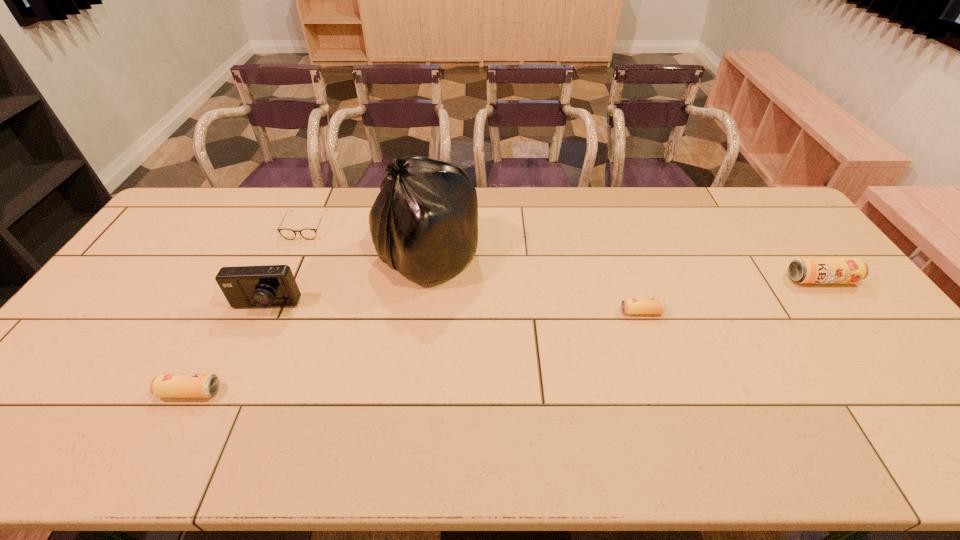
Identify the location of blank area located on the right of the second shortest beer can. Image resolution: width=960 pixels, height=540 pixels. (382, 392).

Where is `free space located 0.080m on the left of the fifth object from left to right`? The height and width of the screenshot is (540, 960). free space located 0.080m on the left of the fifth object from left to right is located at coordinates (x=592, y=312).

The height and width of the screenshot is (540, 960). Find the location of `blank space located on the left of the tallest beer can`. blank space located on the left of the tallest beer can is located at coordinates (712, 280).

Locate an element on the screen. free space located on the front-facing side of the second tallest object is located at coordinates (220, 407).

Locate an element on the screen. Image resolution: width=960 pixels, height=540 pixels. free space located 0.240m through the lenses of the spectacles is located at coordinates (276, 294).

At what (x,y) coordinates should I click in order to perform the action: click on vacant position located on the right of the tallest object. Please return your answer as a coordinate pair (x, y). Looking at the image, I should click on (569, 255).

You are a GUI agent. You are given a task and a screenshot of the screen. Output one action in this format:
    pyautogui.click(x=<x>, y=<y>)
    Task: Click on the spectacles present at the far edge
    Image resolution: width=960 pixels, height=540 pixels.
    Given the screenshot: What is the action you would take?
    pyautogui.click(x=289, y=234)

This screenshot has width=960, height=540. What are the coordinates of `plastic bag that is at the far edge` in the screenshot? It's located at (424, 222).

Identify the location of object situated at the near edge. (165, 385).

Locate an element on the screen. The width and height of the screenshot is (960, 540). object situated at the right edge is located at coordinates (801, 270).